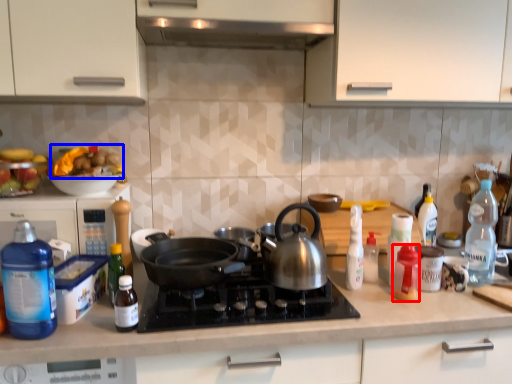
Question: Which point is closer to the camera, bottle (highlighted by a red box) or food (highlighted by a blue box)?

Choices:
 (A) bottle
 (B) food

Answer: (A)